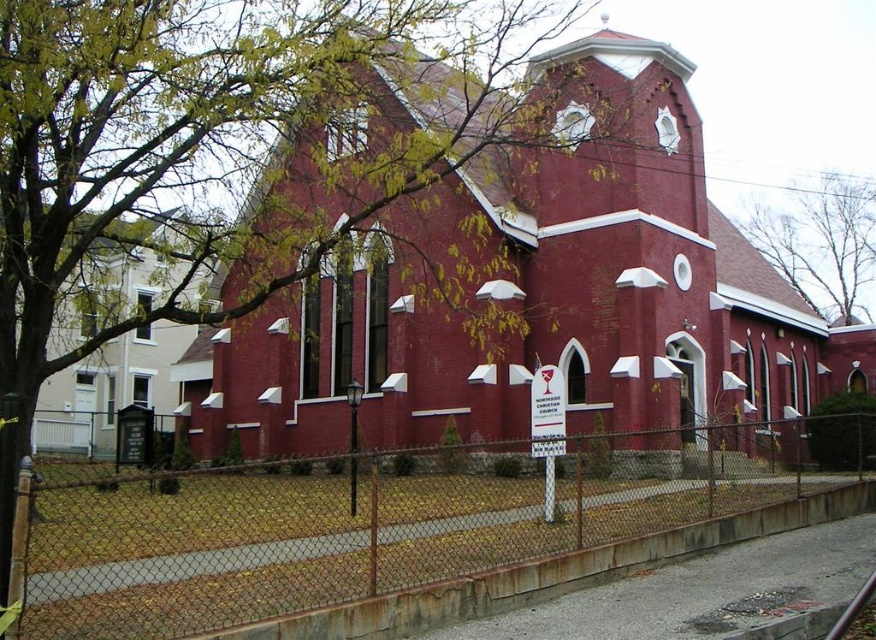
Question: Which object is closer to the camera taking this photo?

Choices:
 (A) matte brick church at center
 (B) rusty chain-link fence at lower center
 (C) brown leafy tree at upper center

Answer: (B)

Question: Is matte brick church at center to the left of rusty chain-link fence at lower center from the viewer's perspective?

Choices:
 (A) no
 (B) yes

Answer: (A)

Question: Which object is the closest to the matte brick church at center?

Choices:
 (A) brown leafy tree at upper center
 (B) rusty chain-link fence at lower center

Answer: (B)

Question: Can you confirm if matte brick church at center is positioned above rusty chain-link fence at lower center?

Choices:
 (A) yes
 (B) no

Answer: (A)

Question: Does matte brick church at center have a lesser width compared to rusty chain-link fence at lower center?

Choices:
 (A) no
 (B) yes

Answer: (A)

Question: Which point is closer to the camera?

Choices:
 (A) (825, 177)
 (B) (615, 417)

Answer: (B)